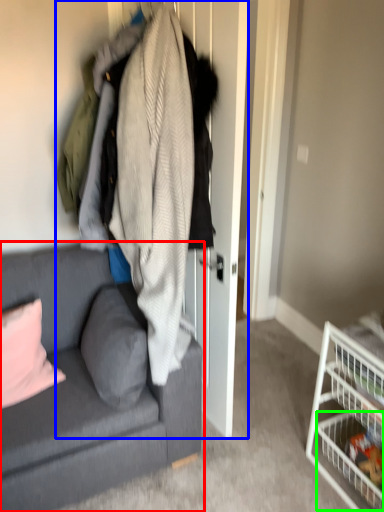
Question: Which is farther away from studio couch (highlighted by a red box)? closet (highlighted by a blue box) or shelf (highlighted by a green box)?

Choices:
 (A) closet
 (B) shelf

Answer: (B)